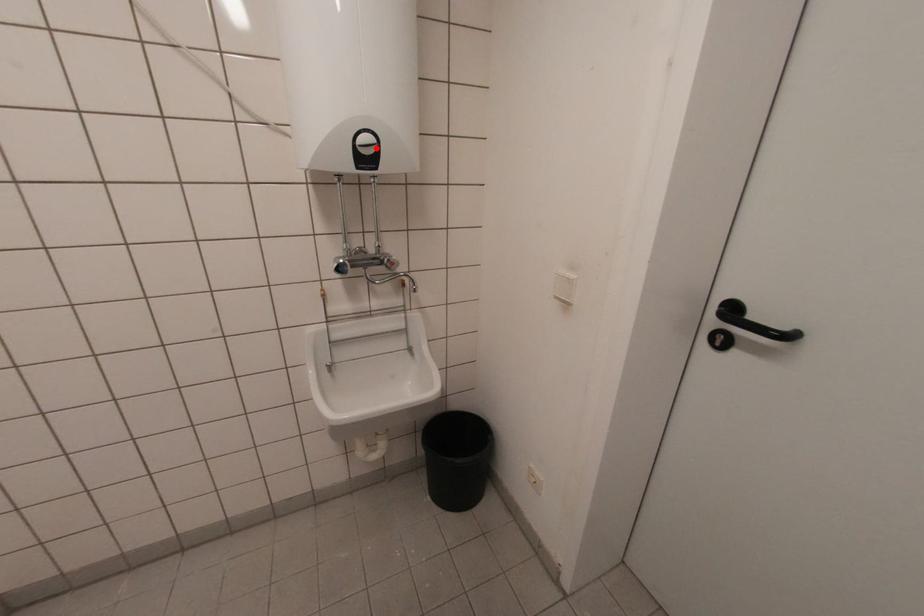
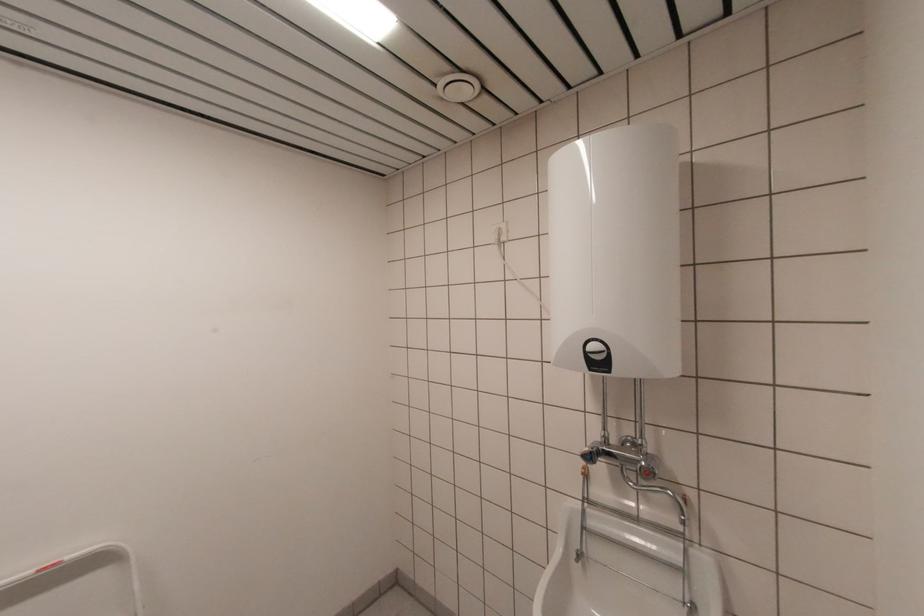
Question: I am providing you with two images of the same scene from different viewpoints. A red point is marked on the first image. At the location where the point appears in image 1, is it still visible in image 2?

Choices:
 (A) Yes
 (B) No

Answer: (A)